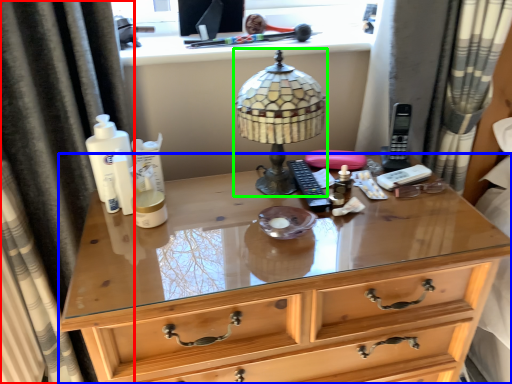
Question: Estimate the real-world distances between objects in this image. Which object is closer to curtain (highlighted by a red box), chest of drawers (highlighted by a blue box) or lamp (highlighted by a green box)?

Choices:
 (A) chest of drawers
 (B) lamp

Answer: (A)